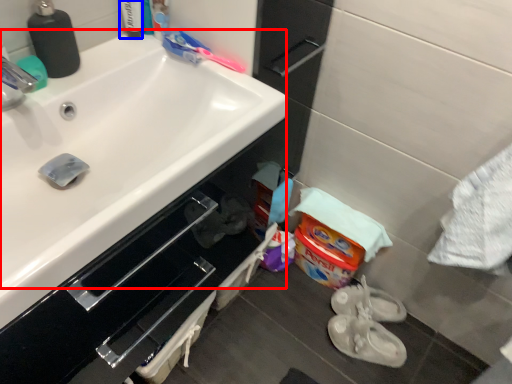
Question: Which point is further to the camera, sink (highlighted by a red box) or toiletry (highlighted by a blue box)?

Choices:
 (A) sink
 (B) toiletry

Answer: (B)